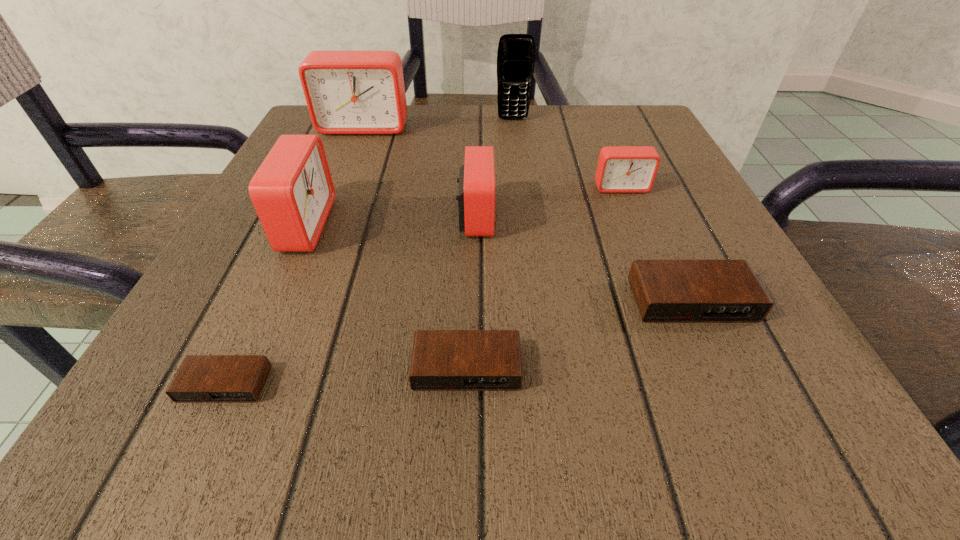
Locate an element on the screen. This screenshot has width=960, height=540. free space at the far right corner of the desktop is located at coordinates (668, 147).

You are a GUI agent. You are given a task and a screenshot of the screen. Output one action in this format:
    pyautogui.click(x=<x>, y=<y>)
    Task: Click on the empty space that is in between the second smallest black alarm clock and the farthest alarm clock
    The width and height of the screenshot is (960, 540).
    Given the screenshot: What is the action you would take?
    pyautogui.click(x=416, y=247)

This screenshot has width=960, height=540. In order to click on vacant point located between the third smallest red alarm clock and the second black alarm clock from right to left in this screenshot , I will do `click(386, 296)`.

I want to click on free space between the second red alarm clock from right to left and the smallest red alarm clock, so click(x=548, y=202).

Find the location of a particular element. The image size is (960, 540). vacant space that's between the second black alarm clock from left to right and the cellular telephone is located at coordinates (490, 244).

At what (x,y) coordinates should I click in order to perform the action: click on empty space between the second shortest object and the tallest alarm clock. Please return your answer as a coordinate pair (x, y). Looking at the image, I should click on (416, 247).

Locate an element on the screen. vacant area between the sixth nearest object and the second red alarm clock from right to left is located at coordinates (548, 202).

Identify the location of free space between the rightmost black alarm clock and the second tallest alarm clock. (497, 262).

Find the location of a particular element. The height and width of the screenshot is (540, 960). vacant space that's between the smallest black alarm clock and the second tallest object is located at coordinates (295, 255).

Where is `free space between the biggest black alarm clock and the smallest red alarm clock`? free space between the biggest black alarm clock and the smallest red alarm clock is located at coordinates (656, 244).